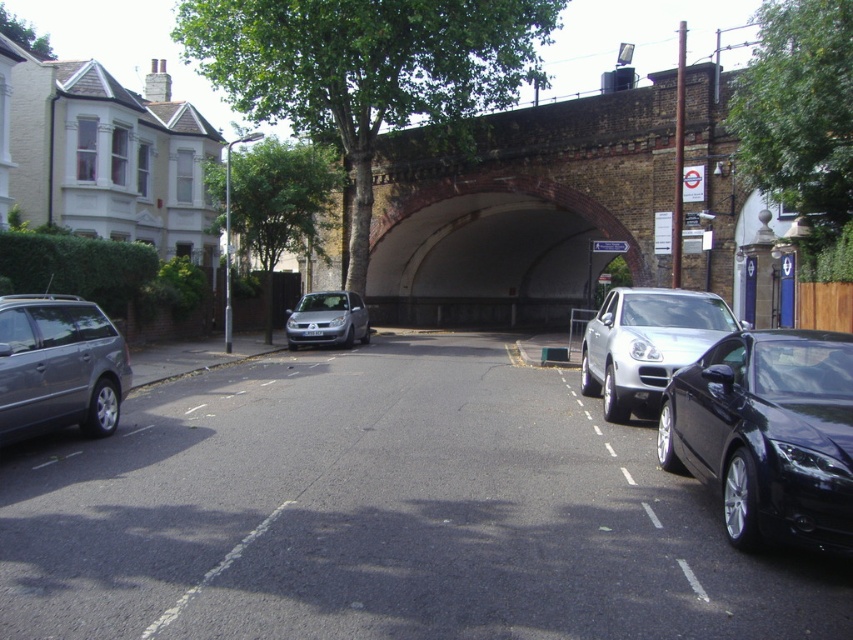
Question: Can you confirm if brick tunnel at center is positioned above concrete tunnel at center?

Choices:
 (A) no
 (B) yes

Answer: (A)

Question: Can you confirm if concrete tunnel at center is smaller than matte gray station wagon at left?

Choices:
 (A) yes
 (B) no

Answer: (B)

Question: Which of these objects is positioned closest to the satin silver suv at center?

Choices:
 (A) satin silver car at center
 (B) concrete tunnel at center
 (C) shiny black car at right

Answer: (C)

Question: Which object appears farthest from the camera in this image?

Choices:
 (A) matte gray station wagon at left
 (B) brick tunnel at center
 (C) shiny black car at right
 (D) concrete tunnel at center

Answer: (D)

Question: Which object is the farthest from the matte gray station wagon at left?

Choices:
 (A) satin silver car at center
 (B) brick tunnel at center
 (C) shiny black car at right

Answer: (B)

Question: Is satin silver suv at center above satin silver car at center?

Choices:
 (A) no
 (B) yes

Answer: (B)